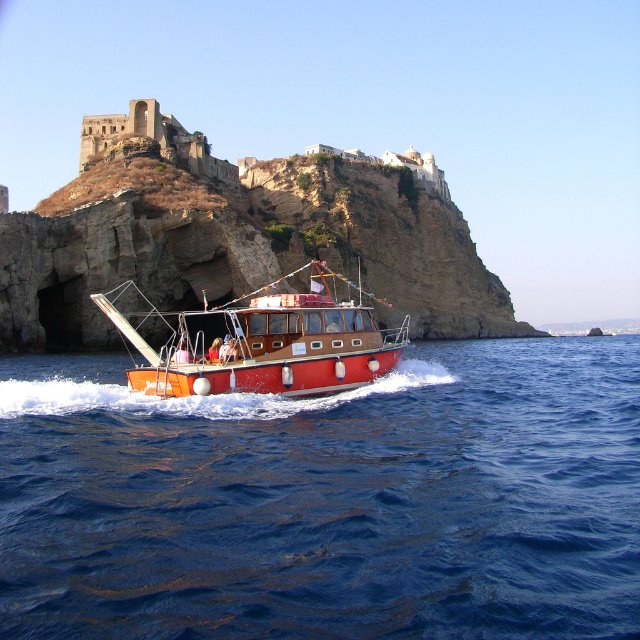
Can you confirm if blue liquid water at center is positioned to the right of shiny red boat at center?

Indeed, blue liquid water at center is positioned on the right side of shiny red boat at center.

Is blue liquid water at center below shiny red boat at center?

Yes.

Is point (577, 442) less distant than point (216, 368)?

Yes, point (577, 442) is in front of point (216, 368).

Where is `blue liquid water at center`? blue liquid water at center is located at coordinates 326,499.